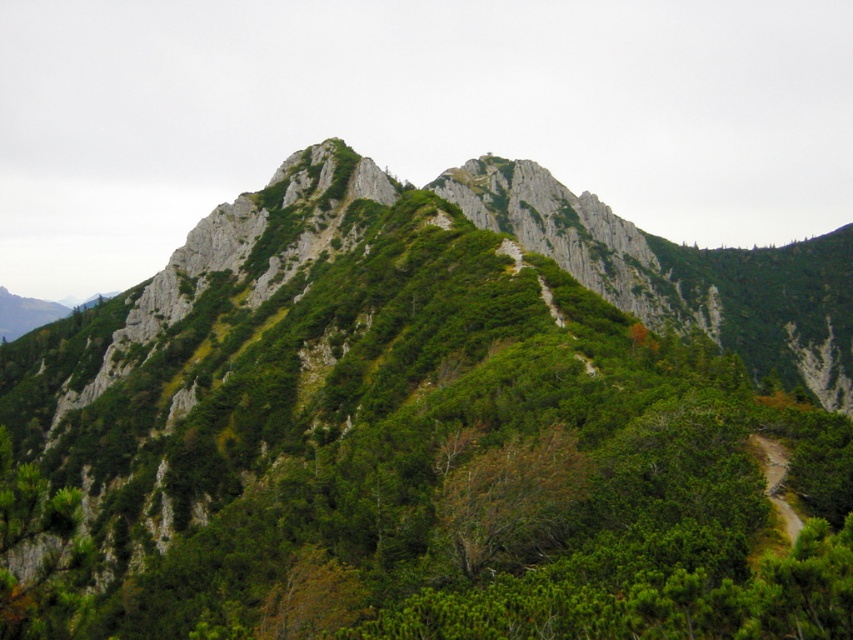
You are a hiker trying to locate a landmark on the mountain. You see a point marked at coordinates point [511,499]. What is the landmark at that location?

The point [511,499] corresponds to the brown leafy tree at center.

You are a hiker planning to reach the peak of the mountain. You see a brown leafy tree at center. Based on its position, is it located closer to the base or the peak of the mountain?

The brown leafy tree at center is located closer to the base of the mountain because it is positioned at point (x=511, y=499), which is lower on the mountain slope compared to the peak area.

You are a hiker planning to ascend the mountain. You see the brown leafy tree at center and the brown dirt path at lower right. Which one is bigger in size?

The brown leafy tree at center has a larger size compared to the brown dirt path at lower right, so the brown leafy tree at center is bigger in size.